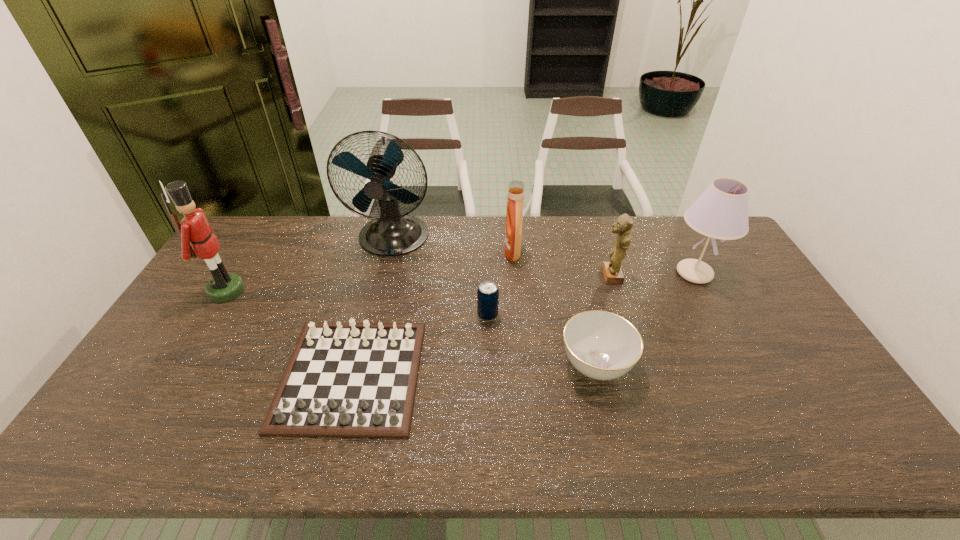
Where is `free space located on the back of the chinaware`? This screenshot has width=960, height=540. free space located on the back of the chinaware is located at coordinates (581, 302).

Find the location of a particular element. The width and height of the screenshot is (960, 540). free space located on the back of the chessboard is located at coordinates (370, 305).

You are a GUI agent. You are given a task and a screenshot of the screen. Output one action in this format:
    pyautogui.click(x=<x>, y=<y>)
    Task: Click on the fan that is at the far edge
    Image resolution: width=960 pixels, height=540 pixels.
    Given the screenshot: What is the action you would take?
    pyautogui.click(x=391, y=234)

The height and width of the screenshot is (540, 960). Identify the location of lampshade that is at the far edge. [x=721, y=212].

Where is `detergent located at the far edge`? detergent located at the far edge is located at coordinates (513, 232).

At what (x,y) coordinates should I click in order to perform the action: click on object at the near edge. Please return your answer as a coordinate pair (x, y). The image size is (960, 540). Looking at the image, I should click on (353, 380).

The width and height of the screenshot is (960, 540). I want to click on object at the left edge, so click(x=194, y=227).

Locate an element on the screen. object at the right edge is located at coordinates (721, 212).

In order to click on object that is at the far right corner in this screenshot , I will do tap(721, 212).

The image size is (960, 540). I want to click on vacant space at the far edge, so click(650, 244).